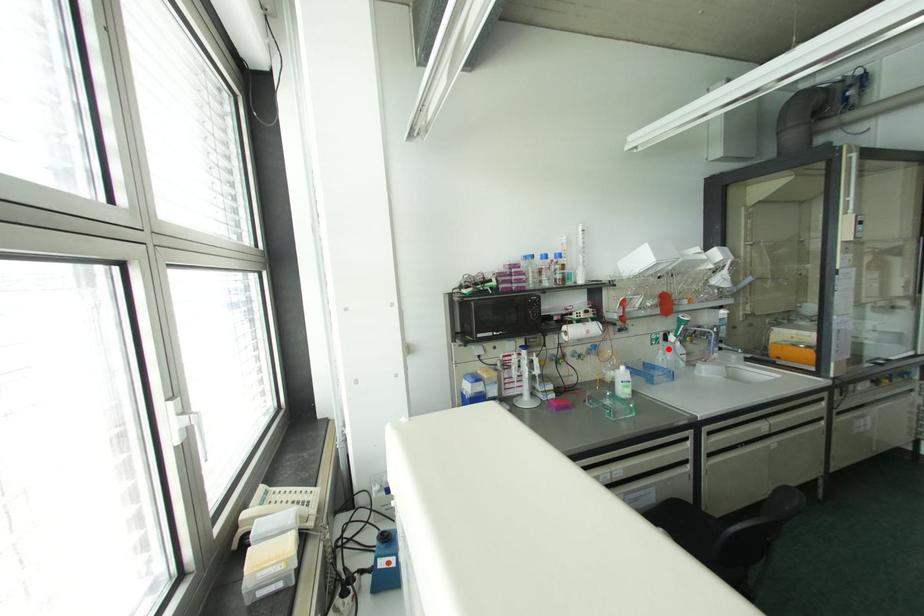
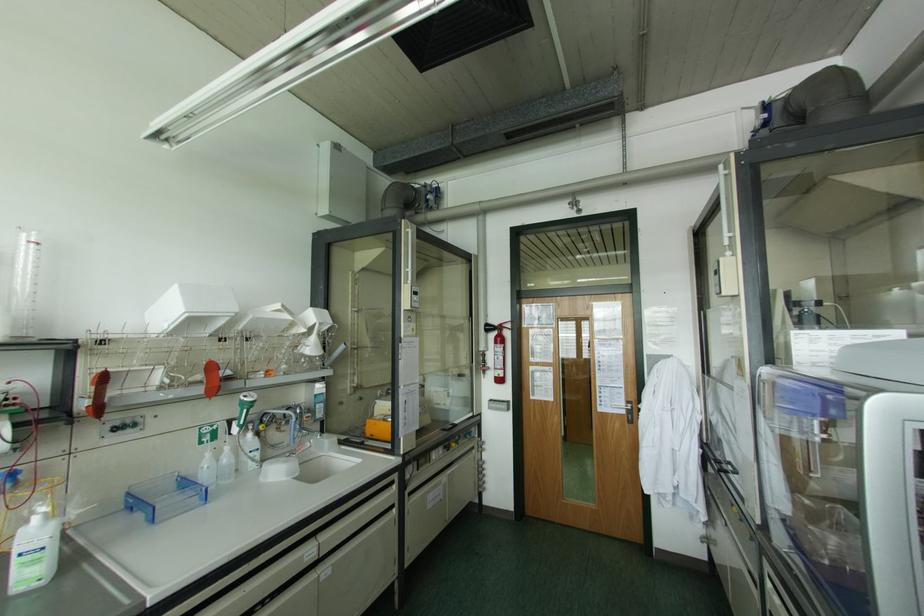
Question: I am providing you with two images of the same scene from different viewpoints. In image1, a red point is highlighted. Considering the same 3D point in image2, which of the following is correct?

Choices:
 (A) It is closer
 (B) It is farther

Answer: (A)